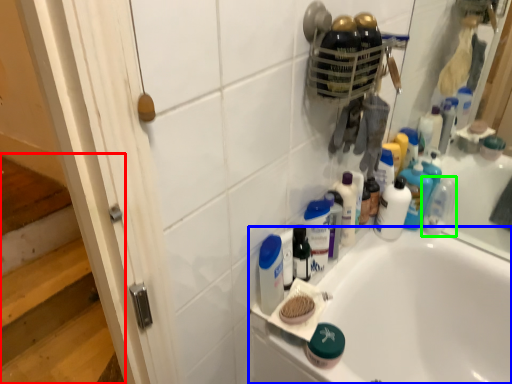
Question: Which object is the closest to the stairwell (highlighted by a red box)? Choose among these: bathtub (highlighted by a blue box) or toiletry (highlighted by a green box).

Choices:
 (A) bathtub
 (B) toiletry

Answer: (A)